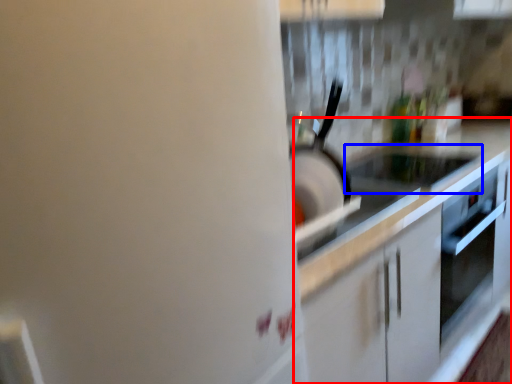
Question: Which object appears farthest to the camera in this image, countertop (highlighted by a red box) or appliance (highlighted by a blue box)?

Choices:
 (A) countertop
 (B) appliance

Answer: (B)